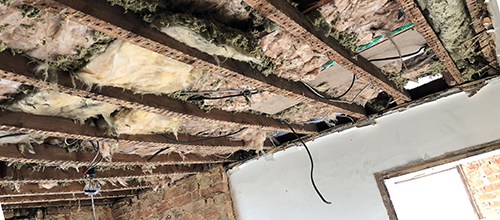
At what (x,y) coordinates should I click in order to perform the action: click on window pane. Please return your answer as a coordinate pair (x, y). Looking at the image, I should click on (469, 151), (385, 198).